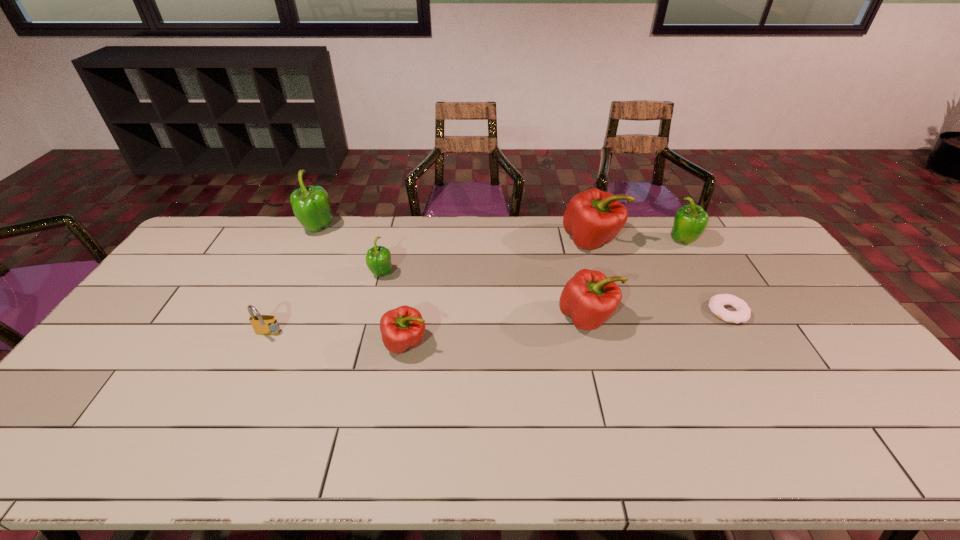
The width and height of the screenshot is (960, 540). In order to click on the biggest green bell pepper in this screenshot , I will do `click(311, 206)`.

Find the location of `the leftmost green bell pepper`. the leftmost green bell pepper is located at coordinates (311, 206).

Where is `the farthest pink bell pepper`? The width and height of the screenshot is (960, 540). the farthest pink bell pepper is located at coordinates (593, 218).

You are a GUI agent. You are given a task and a screenshot of the screen. Output one action in this format:
    pyautogui.click(x=<x>, y=<y>)
    Task: Click on the second smallest green bell pepper
    The width and height of the screenshot is (960, 540).
    Given the screenshot: What is the action you would take?
    pyautogui.click(x=690, y=221)

Where is `the rightmost green bell pepper`? This screenshot has height=540, width=960. the rightmost green bell pepper is located at coordinates (690, 221).

Identify the location of the second biggest pink bell pepper. (589, 298).

This screenshot has height=540, width=960. What are the coordinates of `the nearest green bell pepper` in the screenshot? It's located at (378, 259).

Identify the location of the second green bell pepper from right to left. (378, 259).

Find the location of a particular element. The height and width of the screenshot is (540, 960). the fifth object from right to left is located at coordinates (402, 328).

You are a GUI agent. You are given a task and a screenshot of the screen. Output one action in this format:
    pyautogui.click(x=<x>, y=<y>)
    Task: Click on the leftmost pink bell pepper
    The width and height of the screenshot is (960, 540).
    Given the screenshot: What is the action you would take?
    pyautogui.click(x=402, y=328)